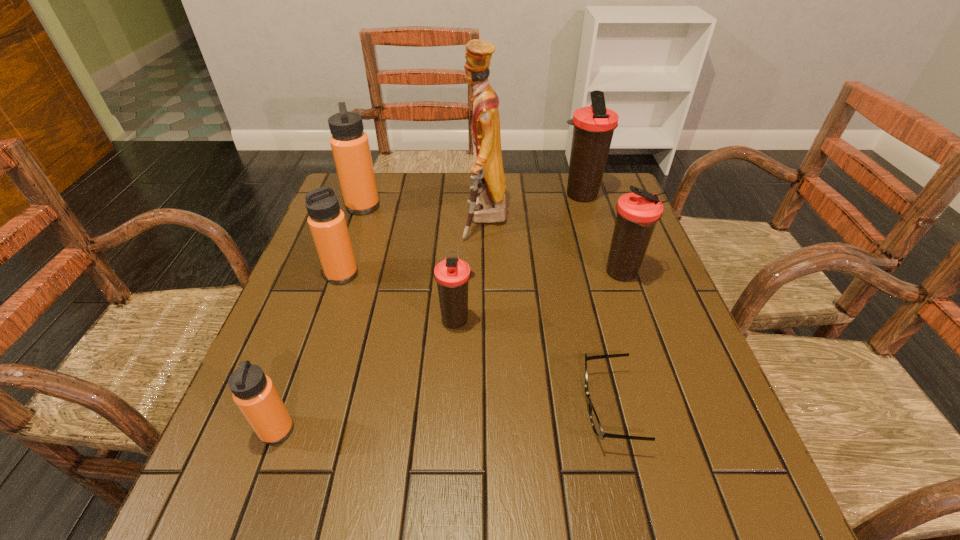
Image resolution: width=960 pixels, height=540 pixels. In order to click on unoccupied position between the farthest brown thermos bottle and the tallest object in this screenshot , I will do `click(533, 208)`.

Locate an element on the screen. This screenshot has height=540, width=960. empty location between the second farthest brown thermos bottle and the farthest orange thermos bottle is located at coordinates (492, 240).

Locate an element on the screen. vacant space in between the biggest orange thermos bottle and the nearest orange thermos bottle is located at coordinates (x=320, y=318).

Where is `object that stands as the closest to the second farthest orange thermos bottle`? The image size is (960, 540). object that stands as the closest to the second farthest orange thermos bottle is located at coordinates (350, 146).

Where is `object that is the fourth closest one to the biggest brown thermos bottle`? object that is the fourth closest one to the biggest brown thermos bottle is located at coordinates pyautogui.click(x=350, y=146).

Locate an element on the screen. thermos bottle that is the fourth closest one to the smallest orange thermos bottle is located at coordinates (637, 213).

Where is `thermos bottle that is the second nearest to the tallest object`? The width and height of the screenshot is (960, 540). thermos bottle that is the second nearest to the tallest object is located at coordinates (637, 213).

Identify which brown thermos bottle is located as the second nearest to the shortest object. Please provide its 2D coordinates. Your answer should be formatted as a tuple, i.e. [(x, y)], where the tuple contains the x and y coordinates of a point satisfying the conditions above.

[(637, 213)]

In order to click on brown thermos bottle that stands as the closest to the second nearest orange thermos bottle in this screenshot , I will do `click(452, 274)`.

Image resolution: width=960 pixels, height=540 pixels. I want to click on the third closest orange thermos bottle to the farthest brown thermos bottle, so click(x=254, y=393).